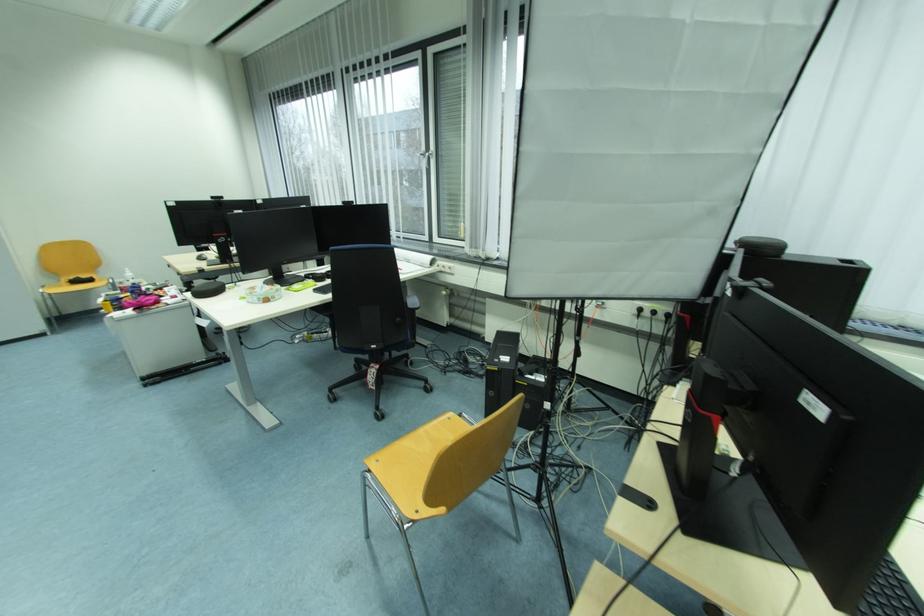
Where is `clear spray bottle`? This screenshot has height=616, width=924. clear spray bottle is located at coordinates (128, 276).